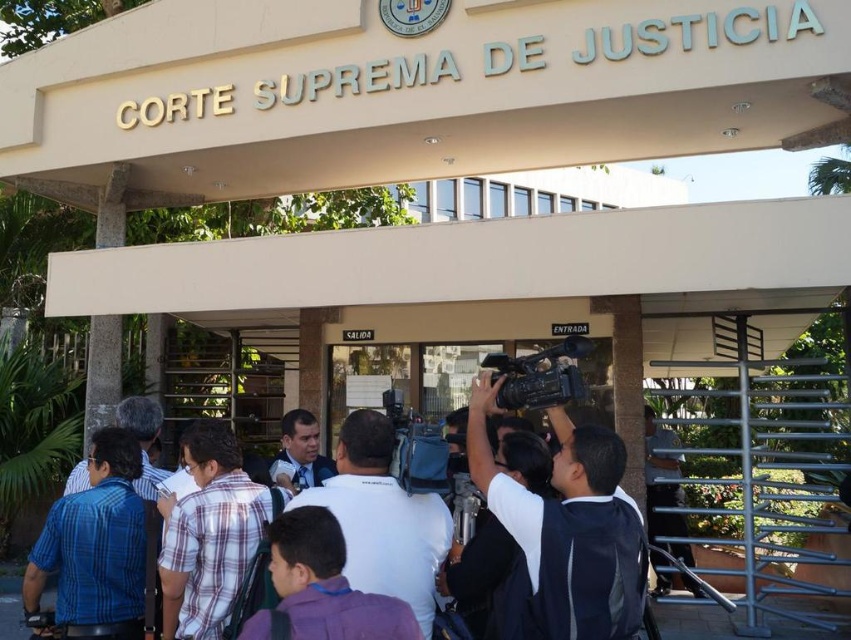
You are a photographer at the Supreme Court of Justice entrance. You need to take a photo of the black plastic video camera at center without including the white shirt at center in the frame. Is this possible given their positions?

The white shirt at center is in front of the black plastic video camera at center, so it would block the view. Therefore, you cannot take a photo of the black plastic video camera at center without including the white shirt at center in the frame.

You are a photographer standing at the entrance of the Supreme Court of Justice. You need to capture a photo of the white shirt at center and the black plastic video camera at center. Can you fit both subjects into your camera frame if your camera has a minimum required distance of 16 inches between objects to focus properly?

The white shirt at center and black plastic video camera at center are 17.03 inches apart from each other. Since the required minimum distance is 16 inches, the photographer can fit both subjects into the frame as the distance is sufficient.

You are a photographer positioned behind the group near the entrance of the Supreme Court of Justice. You need to take a photo of the white shirt at center and the black plastic video camera at center. Which object should you focus on first if you want to capture both in the same frame without adjusting your camera angle?

You should focus on the white shirt at center first because it is taller than the black plastic video camera at center, ensuring it fits within the frame when adjusting the focus.